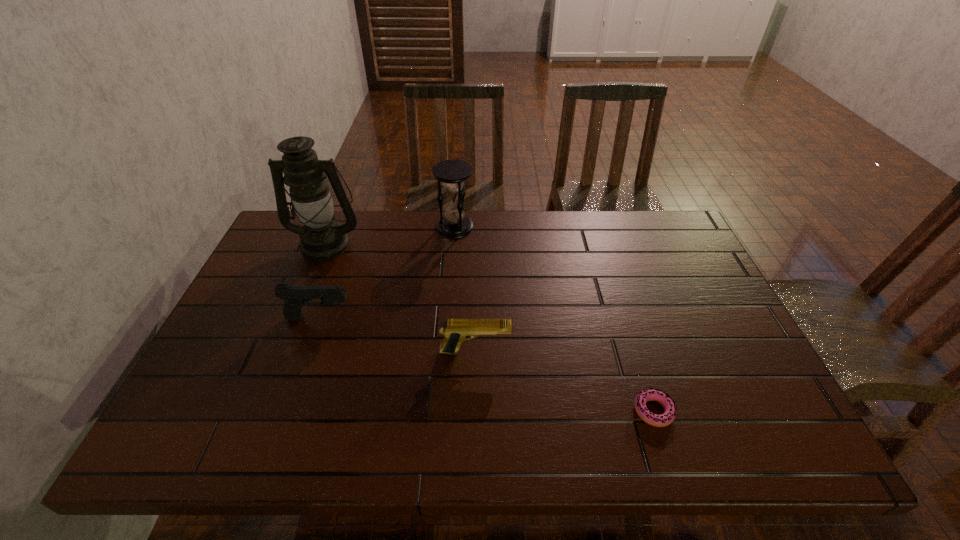
Find the location of `free area in between the third nearest object and the shortest object`. free area in between the third nearest object and the shortest object is located at coordinates (487, 364).

I want to click on empty location between the shortest object and the farther pistol, so click(487, 364).

Identify the location of object that is the nearest to the second tallest object. pos(322,237).

Choose which object is the nearest neighbor to the second tallest object. Please provide its 2D coordinates. Your answer should be formatted as a tuple, i.e. [(x, y)], where the tuple contains the x and y coordinates of a point satisfying the conditions above.

[(322, 237)]

Where is `vacant area in the image that satisfies the following two spatial constraints: 1. on the front side of the rightmost object; 2. on the right side of the hourglass`? This screenshot has height=540, width=960. vacant area in the image that satisfies the following two spatial constraints: 1. on the front side of the rightmost object; 2. on the right side of the hourglass is located at coordinates (443, 411).

Locate an element on the screen. The width and height of the screenshot is (960, 540). blank space that satisfies the following two spatial constraints: 1. on the front side of the hourglass; 2. at the barrel of the left pistol is located at coordinates (448, 318).

This screenshot has height=540, width=960. I want to click on vacant region that satisfies the following two spatial constraints: 1. on the front side of the fourth shortest object; 2. at the barrel of the left pistol, so click(448, 318).

Where is `vacant region that satisfies the following two spatial constraints: 1. at the barrel of the third nearest object; 2. on the back side of the nearest object`? The height and width of the screenshot is (540, 960). vacant region that satisfies the following two spatial constraints: 1. at the barrel of the third nearest object; 2. on the back side of the nearest object is located at coordinates (286, 411).